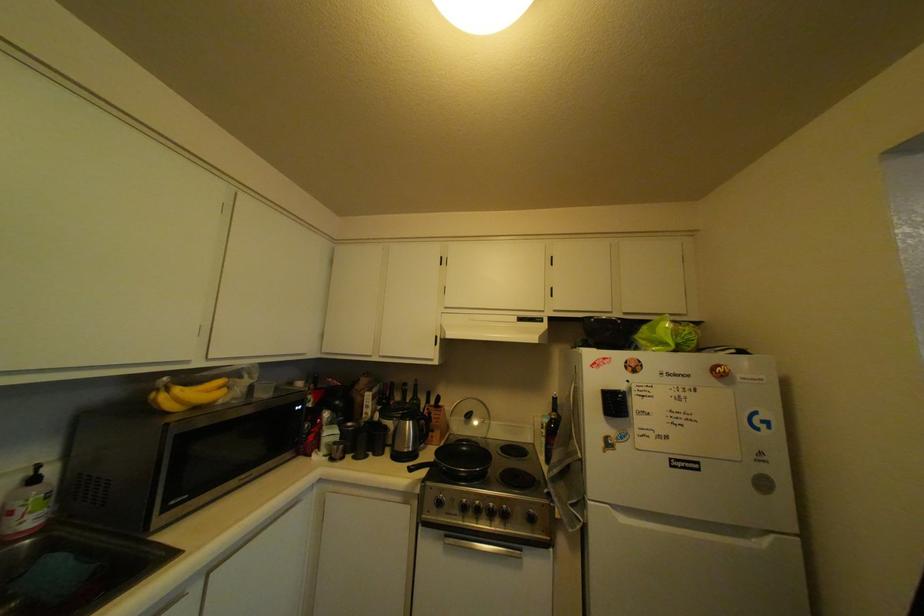
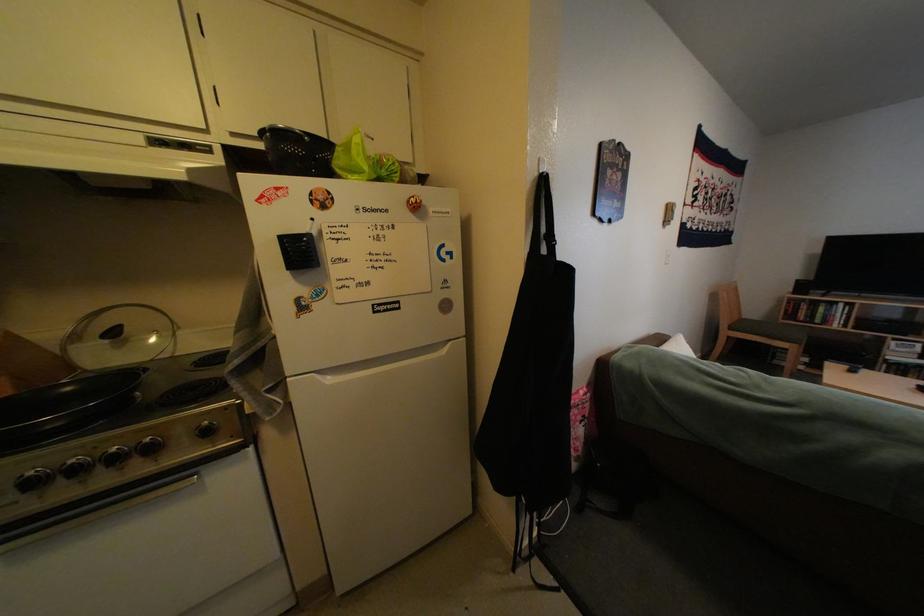
In the second image, find the point that corresponds to [459,538] in the first image.

(10, 546)